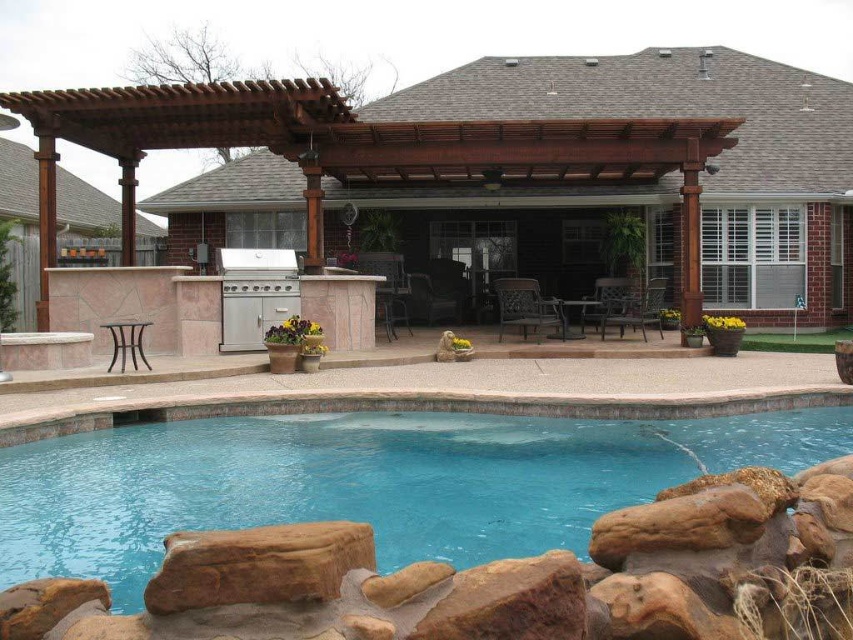
You are planning to install a new lighting system in the backyard. The lights need to be placed above the brown wood pergola at center and the blue smooth water at center. Considering their heights, which object requires higher mounting points for the lights?

The brown wood pergola at center requires higher mounting points for the lights since it has a greater height compared to the blue smooth water at center.